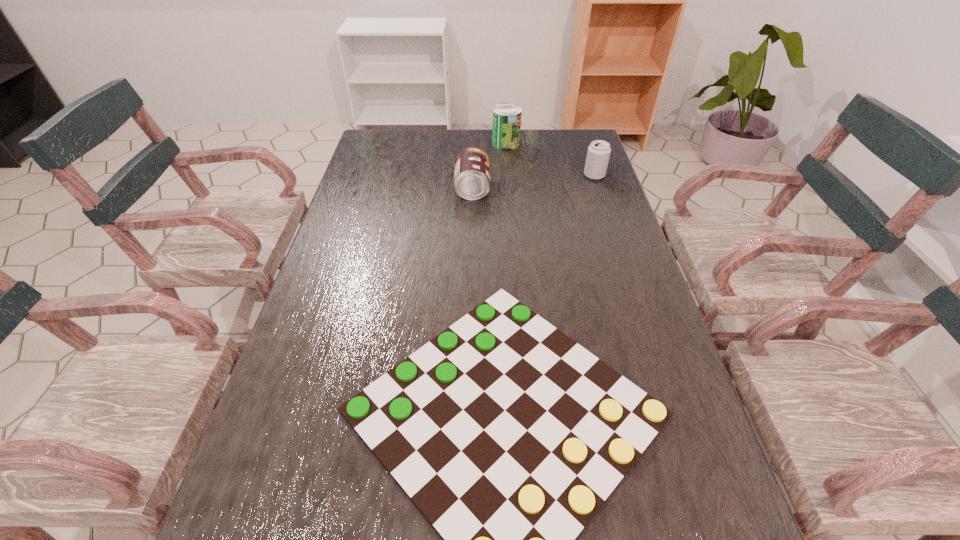
I want to click on the farthest object, so click(506, 126).

Where is `the second can from left to right`? the second can from left to right is located at coordinates (506, 126).

Find the location of `the rightmost can`. the rightmost can is located at coordinates (598, 154).

The height and width of the screenshot is (540, 960). In order to click on the leftmost can in this screenshot , I will do `click(472, 165)`.

This screenshot has height=540, width=960. In order to click on free location located on the front of the second can from right to left in this screenshot , I will do `click(507, 157)`.

The width and height of the screenshot is (960, 540). Identify the location of vacant space located on the left of the rightmost can. (560, 176).

This screenshot has width=960, height=540. Find the location of `vacant space located 0.320m on the front label of the leftmost can`. vacant space located 0.320m on the front label of the leftmost can is located at coordinates (590, 188).

This screenshot has height=540, width=960. I want to click on object that is positioned at the far edge, so click(506, 126).

Identify the location of object that is at the right edge. (598, 154).

In order to click on free location at the far edge in this screenshot , I will do `click(414, 141)`.